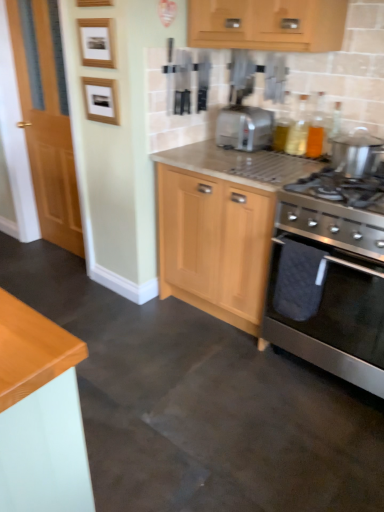
Find the location of `stainless steel gas stove at right`. stainless steel gas stove at right is located at coordinates (336, 211).

The height and width of the screenshot is (512, 384). Describe the element at coordinates (298, 129) in the screenshot. I see `translucent glass bottle at upper right, the first bottle when ordered from left to right` at that location.

Locate an element on the screen. wooden picture frame at upper left, the first picture frame from the bottom is located at coordinates (101, 100).

Measure the distance between point (x=95, y=112) and camera.

They are 7.53 feet apart.

This screenshot has width=384, height=512. Describe the element at coordinates (46, 119) in the screenshot. I see `wooden door at left` at that location.

Find the location of a particular element. This screenshot has width=384, height=512. stainless steel oven at lower right is located at coordinates (327, 310).

Describe the element at coordinates (327, 310) in the screenshot. I see `stainless steel oven at lower right` at that location.

You are a GUI agent. You are given a task and a screenshot of the screen. Output one action in this format:
    pyautogui.click(x=<x>, y=<y>)
    Task: Click on the satin silver toaster at center
    
    Given the screenshot: What is the action you would take?
    pyautogui.click(x=244, y=128)

This screenshot has width=384, height=512. I want to click on light wood cabinet at center, so click(x=220, y=226).

The width and height of the screenshot is (384, 512). I want to click on the 2nd bottle above the stainless steel gas stove at right (from the image's perspective), so click(x=298, y=129).

From the image's perspective, is translucent glass bottle at upper right, the first bottle when ordered from left to right, positioned above or below stainless steel gas stove at right?

Based on their image positions, translucent glass bottle at upper right, the first bottle when ordered from left to right, is located above stainless steel gas stove at right.

How distant is translucent glass bottle at upper right, the second bottle viewed from the right, from stainless steel gas stove at right?

translucent glass bottle at upper right, the second bottle viewed from the right, and stainless steel gas stove at right are 28.03 inches apart.

Is point (322, 111) closer or farther from the camera than point (367, 263)?

Clearly, point (322, 111) is more distant from the camera than point (367, 263).

Based on their sizes in the image, would you say translucent glass bottles at upper right, arranged as the 2th bottle when viewed from the left, is bigger or smaller than stainless steel oven at lower right?

translucent glass bottles at upper right, arranged as the 2th bottle when viewed from the left, is smaller than stainless steel oven at lower right.

From a real-world perspective, which object rests below the other?

From a 3D spatial view, stainless steel oven at lower right is below.

Is translucent glass bottles at upper right, the first bottle from the right, at the left side of satin silver toaster at center?

No.

How much distance is there between translucent glass bottles at upper right, arranged as the 2th bottle when viewed from the left, and satin silver toaster at center?

translucent glass bottles at upper right, arranged as the 2th bottle when viewed from the left, is 12.64 inches away from satin silver toaster at center.

From the picture: Can you see translucent glass bottles at upper right, the first bottle from the right, touching satin silver toaster at center?

No, translucent glass bottles at upper right, the first bottle from the right, is not next to satin silver toaster at center.

From the image's perspective, who appears lower, translucent glass bottles at upper right, arranged as the 2th bottle when viewed from the left, or satin silver toaster at center?

translucent glass bottles at upper right, arranged as the 2th bottle when viewed from the left.

From a real-world perspective, who is located higher, satin silver toaster at center or wooden picture frame at upper left, positioned as the second picture frame in top-to-bottom order?

From a 3D spatial view, wooden picture frame at upper left, positioned as the second picture frame in top-to-bottom order, is above.

Is point (249, 122) farther from viewer compared to point (91, 106)?

No.

In the image, there is a wooden picture frame at upper left, the first picture frame from the bottom. Where is `toaster below it (from a real-world perspective)`? toaster below it (from a real-world perspective) is located at coordinates (244, 128).

Is wooden picture frame at upper left, which appears as the 1th picture frame when viewed from the top, aimed at satin silver toaster at center?

No, wooden picture frame at upper left, which appears as the 1th picture frame when viewed from the top, is not facing towards satin silver toaster at center.

From the image's perspective, is wooden picture frame at upper left, which ranks as the second picture frame in bottom-to-top order, above or below satin silver toaster at center?

wooden picture frame at upper left, which ranks as the second picture frame in bottom-to-top order, is situated higher than satin silver toaster at center in the image.

Can you confirm if wooden picture frame at upper left, which appears as the 1th picture frame when viewed from the top, is positioned to the left of satin silver toaster at center?

Indeed, wooden picture frame at upper left, which appears as the 1th picture frame when viewed from the top, is positioned on the left side of satin silver toaster at center.

Is translucent glass bottle at upper right, the second bottle viewed from the right, to the left or to the right of wooden door at left in the image?

From the image, it's evident that translucent glass bottle at upper right, the second bottle viewed from the right, is to the right of wooden door at left.

Which point is more forward, (302,125) or (31,96)?

The point (302,125) is more forward.

Is translucent glass bottle at upper right, the first bottle when ordered from left to right, in front of or behind wooden door at left in the image?

Visually, translucent glass bottle at upper right, the first bottle when ordered from left to right, is located in front of wooden door at left.

Is translucent glass bottle at upper right, the second bottle viewed from the right, located outside wooden door at left?

translucent glass bottle at upper right, the second bottle viewed from the right, lies outside wooden door at left's area.

Which of these two, satin silver toaster at center or stainless steel gas stove at right, is smaller?

Smaller between the two is satin silver toaster at center.

Which point is more forward, [262,139] or [297,182]?

The point [297,182] is more forward.

Which is more to the right, satin silver toaster at center or stainless steel gas stove at right?

stainless steel gas stove at right.

Where is `toaster above the stainless steel gas stove at right (from the image's perspective)`? The width and height of the screenshot is (384, 512). toaster above the stainless steel gas stove at right (from the image's perspective) is located at coordinates (244, 128).

Identify the location of bottle that is the 2nd one when counting backward from the stainless steel gas stove at right. The width and height of the screenshot is (384, 512). (298, 129).

Where is `oven in front of the translucent glass bottles at upper right, arranged as the 2th bottle when viewed from the left`? Image resolution: width=384 pixels, height=512 pixels. oven in front of the translucent glass bottles at upper right, arranged as the 2th bottle when viewed from the left is located at coordinates (327, 310).

From the picture: Considering their positions, is wooden picture frame at upper left, which appears as the 1th picture frame when viewed from the top, positioned closer to wooden picture frame at upper left, positioned as the second picture frame in top-to-bottom order, than stainless steel oven at lower right?

wooden picture frame at upper left, which appears as the 1th picture frame when viewed from the top, lies closer to wooden picture frame at upper left, positioned as the second picture frame in top-to-bottom order, than the other object.

Based on their spatial positions, is satin silver toaster at center or translucent glass bottle at upper right, the second bottle viewed from the right, closer to stainless steel gas stove at right?

translucent glass bottle at upper right, the second bottle viewed from the right, is positioned closer to the anchor stainless steel gas stove at right.

Which object lies nearer to the anchor point wooden door at left, translucent glass bottles at upper right, arranged as the 2th bottle when viewed from the left, or light wood cabinet at center?

light wood cabinet at center is positioned closer to the anchor wooden door at left.

Considering their positions, is translucent glass bottles at upper right, the first bottle from the right, positioned further to translucent glass bottle at upper right, the first bottle when ordered from left to right, than stainless steel oven at lower right?

stainless steel oven at lower right is positioned further to the anchor translucent glass bottle at upper right, the first bottle when ordered from left to right.

Looking at the image, which one is located closer to stainless steel gas stove at right, stainless steel oven at lower right or translucent glass bottles at upper right, arranged as the 2th bottle when viewed from the left?

stainless steel oven at lower right.

Estimate the real-world distances between objects in this image. Which object is further from satin silver toaster at center, stainless steel oven at lower right or light wood cabinet at center?

stainless steel oven at lower right.

From the image, which object appears to be nearer to light wood cabinet at center, wooden picture frame at upper left, positioned as the second picture frame in top-to-bottom order, or translucent glass bottles at upper right, the first bottle from the right?

wooden picture frame at upper left, positioned as the second picture frame in top-to-bottom order.

Based on their spatial positions, is wooden picture frame at upper left, the first picture frame from the bottom, or wooden picture frame at upper left, which appears as the 1th picture frame when viewed from the top, further from translucent glass bottles at upper right, arranged as the 2th bottle when viewed from the left?

Based on the image, wooden picture frame at upper left, which appears as the 1th picture frame when viewed from the top, appears to be further to translucent glass bottles at upper right, arranged as the 2th bottle when viewed from the left.

The height and width of the screenshot is (512, 384). Find the location of `bottle between wooden picture frame at upper left, the first picture frame from the bottom, and translucent glass bottles at upper right, the first bottle from the right, in the horizontal direction`. bottle between wooden picture frame at upper left, the first picture frame from the bottom, and translucent glass bottles at upper right, the first bottle from the right, in the horizontal direction is located at coordinates (298, 129).

Identify the location of gas stove between satin silver toaster at center and stainless steel oven at lower right in the vertical direction. (x=336, y=211).

Locate an element on the screen. The height and width of the screenshot is (512, 384). picture frame located between wooden picture frame at upper left, the first picture frame from the bottom, and translucent glass bottles at upper right, arranged as the 2th bottle when viewed from the left, in the left-right direction is located at coordinates (97, 42).

Identify the location of toaster between wooden door at left and translucent glass bottles at upper right, arranged as the 2th bottle when viewed from the left. (244, 128).